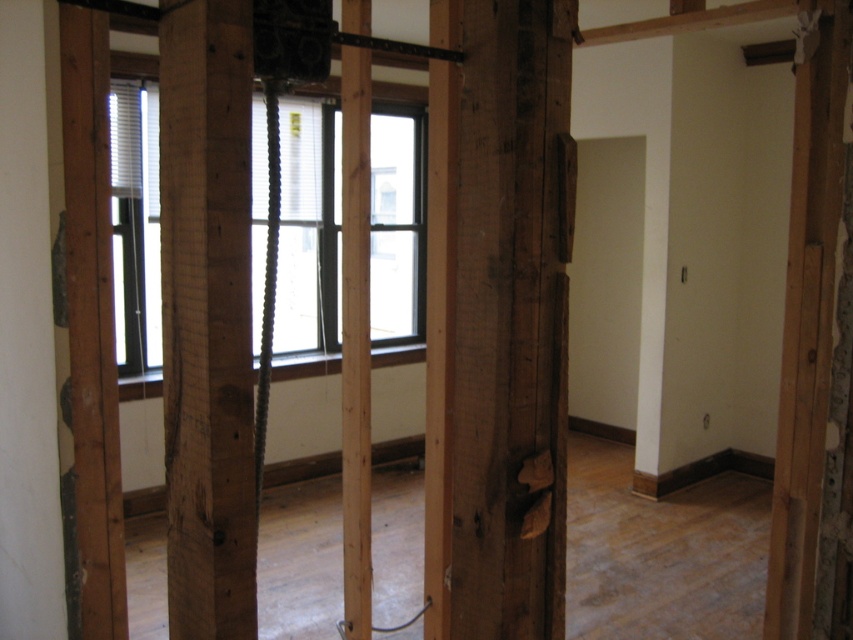
Which is behind, point (256, 195) or point (143, 371)?

Positioned behind is point (256, 195).

Who is more forward, (424, 90) or (126, 84)?

Positioned in front is point (126, 84).

Does point (297, 140) lie behind point (148, 196)?

Yes, it is.

Find the location of a particular element. The width and height of the screenshot is (853, 640). clear glass window at center is located at coordinates (308, 241).